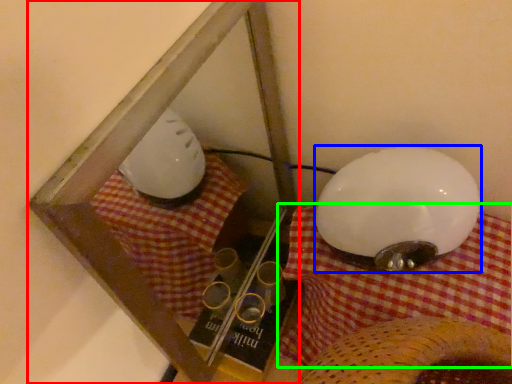
Question: Which is nearer to the glass box (highlighted by a red box)? lamp (highlighted by a blue box) or blanket (highlighted by a green box).

Choices:
 (A) lamp
 (B) blanket

Answer: (B)